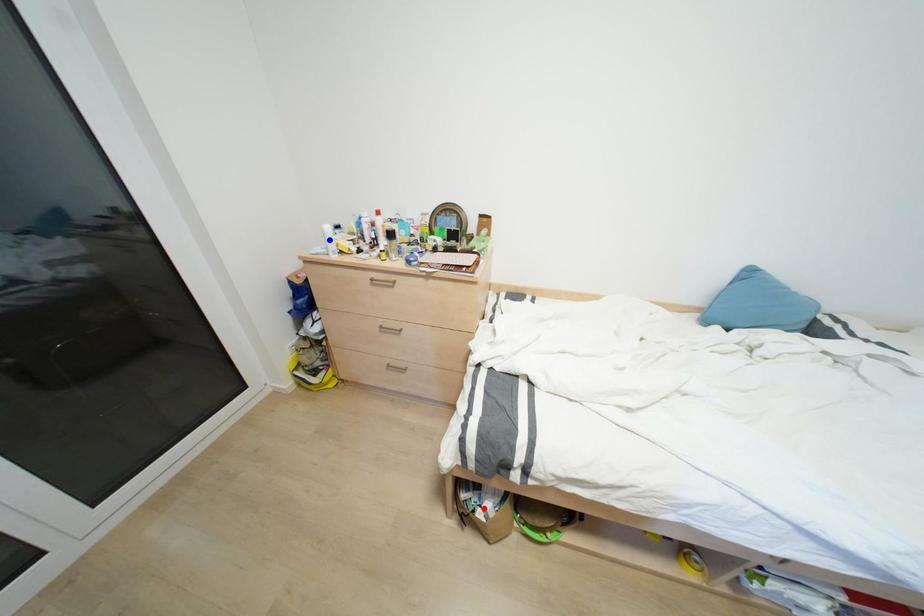
Question: Two points are marked on the image. Which point is closer to the camera?

Choices:
 (A) Blue point is closer.
 (B) Red point is closer.

Answer: (B)